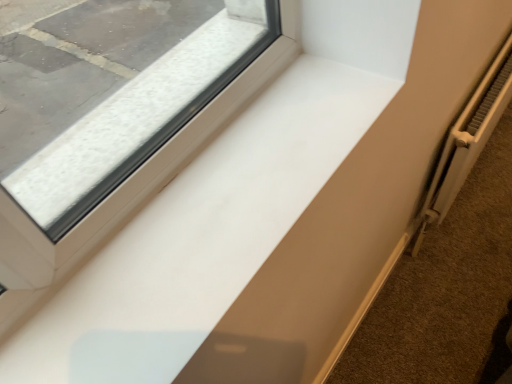
What do you see at coordinates (466, 141) in the screenshot?
I see `white metallic radiator at right` at bounding box center [466, 141].

Describe the element at coordinates (447, 291) in the screenshot. Image resolution: width=512 pixels, height=384 pixels. I see `white matte radiator at lower right` at that location.

The height and width of the screenshot is (384, 512). I want to click on white metallic radiator at right, so click(x=466, y=141).

Is point (468, 341) positioned after point (159, 43)?

Yes, it is.

Which is more to the left, white matte radiator at lower right or white glossy window sill at center?

white glossy window sill at center.

What's the angular difference between white matte radiator at lower right and white glossy window sill at center's facing directions?

white matte radiator at lower right and white glossy window sill at center are facing 90.1 degrees away from each other.

From the image's perspective, which one is positioned higher, white matte radiator at lower right or white glossy window sill at center?

white glossy window sill at center.

How much distance is there between white metallic radiator at right and white matte radiator at lower right?

white metallic radiator at right is 12.41 inches away from white matte radiator at lower right.

From a real-world perspective, is white metallic radiator at right positioned over white matte radiator at lower right based on gravity?

Yes, from a real-world perspective, white metallic radiator at right is over white matte radiator at lower right

In the scene shown: Between white metallic radiator at right and white matte radiator at lower right, which one has smaller width?

With smaller width is white metallic radiator at right.

Is point (420, 238) farther from camera compared to point (422, 253)?

That is True.

Is white matte radiator at lower right positioned far away from white metallic radiator at right?

No, white matte radiator at lower right is in close proximity to white metallic radiator at right.

Considering the relative sizes of white matte radiator at lower right and white metallic radiator at right in the image provided, is white matte radiator at lower right thinner than white metallic radiator at right?

In fact, white matte radiator at lower right might be wider than white metallic radiator at right.

From the image's perspective, between white matte radiator at lower right and white metallic radiator at right, which one is located above?

white metallic radiator at right appears higher in the image.

Is white matte radiator at lower right facing away from white metallic radiator at right?

No, white matte radiator at lower right is not facing the opposite direction of white metallic radiator at right.

Is white metallic radiator at right wider than white glossy window sill at center?

No, white metallic radiator at right is not wider than white glossy window sill at center.

Considering their positions, is white metallic radiator at right located in front of or behind white glossy window sill at center?

white metallic radiator at right is behind white glossy window sill at center.

Does white metallic radiator at right contain white glossy window sill at center?

No, white glossy window sill at center is not surrounded by white metallic radiator at right.

Considering the positions of point (134, 143) and point (365, 373), is point (134, 143) closer or farther from the camera than point (365, 373)?

Point (134, 143) is closer to the camera than point (365, 373).

Can you confirm if white glossy window sill at center is positioned to the right of white matte radiator at lower right?

No.

Is white glossy window sill at center facing away from white matte radiator at lower right?

No, white glossy window sill at center is not facing away from white matte radiator at lower right.

Considering the sizes of objects white glossy window sill at center and white matte radiator at lower right in the image provided, who is smaller, white glossy window sill at center or white matte radiator at lower right?

With smaller size is white glossy window sill at center.

From a real-world perspective, is white glossy window sill at center beneath white metallic radiator at right?

No, from a real-world perspective, white glossy window sill at center is not beneath white metallic radiator at right.

Would you say white glossy window sill at center is inside or outside white metallic radiator at right?

white glossy window sill at center is not inside white metallic radiator at right, it's outside.

Is white glossy window sill at center smaller than white metallic radiator at right?

Yes.

In order to click on window that is above the white matte radiator at lower right (from the image's perspective) in this screenshot , I will do `click(113, 115)`.

What are the coordinates of `radiator above the white matte radiator at lower right (from a real-world perspective)` in the screenshot? It's located at (466, 141).

From the image, which object appears to be farther from white matte radiator at lower right, white glossy window sill at center or white metallic radiator at right?

white glossy window sill at center is further to white matte radiator at lower right.

Looking at the image, which one is located further to white matte radiator at lower right, white metallic radiator at right or white glossy window sill at center?

white glossy window sill at center is positioned further to the anchor white matte radiator at lower right.

Which object lies nearer to the anchor point white metallic radiator at right, white matte radiator at lower right or white glossy window sill at center?

Among the two, white matte radiator at lower right is located nearer to white metallic radiator at right.

When comparing their distances from white glossy window sill at center, does white metallic radiator at right or white matte radiator at lower right seem closer?

The object closer to white glossy window sill at center is white metallic radiator at right.

Based on their spatial positions, is white matte radiator at lower right or white metallic radiator at right further from white glossy window sill at center?

Based on the image, white matte radiator at lower right appears to be further to white glossy window sill at center.

When comparing their distances from white metallic radiator at right, does white glossy window sill at center or white matte radiator at lower right seem closer?

white matte radiator at lower right is positioned closer to the anchor white metallic radiator at right.

Find the location of a particular element. The height and width of the screenshot is (384, 512). pavement between white glossy window sill at center and white metallic radiator at right from left to right is located at coordinates pyautogui.click(x=447, y=291).